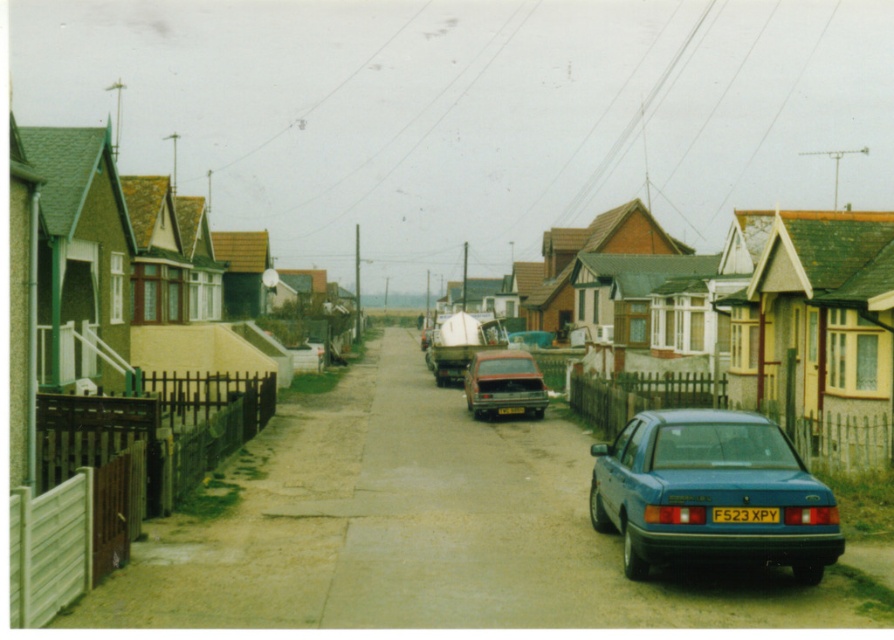
Question: Which of the following is the farthest from the observer?

Choices:
 (A) (766, 513)
 (B) (688, 518)
 (C) (499, 406)
 (D) (469, 444)

Answer: (C)

Question: Which of the following is the farthest from the observer?

Choices:
 (A) yellow plastic license plate at center
 (B) matte red car at center

Answer: (B)

Question: Estimate the real-world distances between objects in this image. Which object is closer to the blue metallic sedan at center?

Choices:
 (A) yellow plastic license plate at center
 (B) matte white boat at center
 (C) matte red car at center
 (D) yellow matte license plate at center

Answer: (D)

Question: Does blue metallic sedan at center appear on the right side of yellow matte license plate at center?

Choices:
 (A) yes
 (B) no

Answer: (B)

Question: Considering the relative positions of matte red car at center and yellow plastic license plate at center in the image provided, where is matte red car at center located with respect to yellow plastic license plate at center?

Choices:
 (A) above
 (B) below

Answer: (A)

Question: Does matte red car at center appear on the right side of matte white boat at center?

Choices:
 (A) yes
 (B) no

Answer: (A)